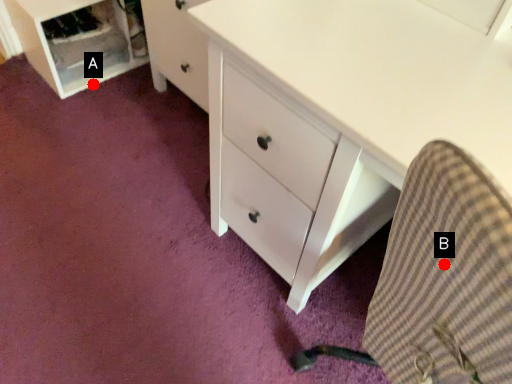
Question: Two points are circled on the image, labeled by A and B beside each circle. Which point is farther from the camera taking this photo?

Choices:
 (A) A is further
 (B) B is further

Answer: (A)